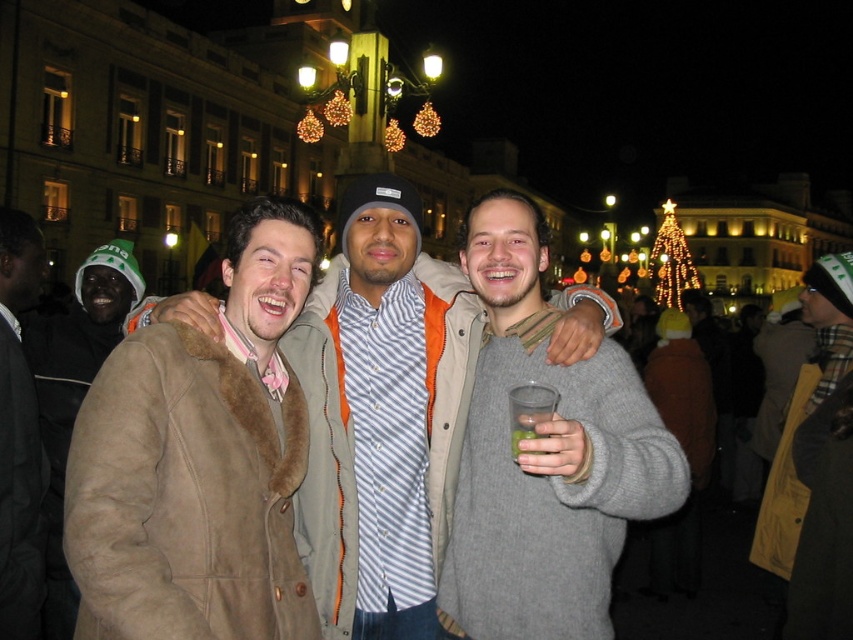
Question: Which of the following is the farthest from the observer?

Choices:
 (A) green translucent plastic cup at center
 (B) suede jacket at center
 (C) gray sweater at center

Answer: (B)

Question: Does dark brown fur coat at left have a larger size compared to green translucent plastic cup at center?

Choices:
 (A) yes
 (B) no

Answer: (A)

Question: Does brown suede coat at center lie in front of gray sweater at center?

Choices:
 (A) yes
 (B) no

Answer: (A)

Question: Which object appears closest to the camera in this image?

Choices:
 (A) dark gray wool coat at left
 (B) gray sweater at center
 (C) dark brown fur coat at left
 (D) suede jacket at center

Answer: (A)

Question: Is suede jacket at center closer to camera compared to green translucent plastic cup at center?

Choices:
 (A) no
 (B) yes

Answer: (A)

Question: Which point is closer to the camera taking this photo?

Choices:
 (A) (378, 422)
 (B) (660, 477)
 (C) (183, 390)

Answer: (C)